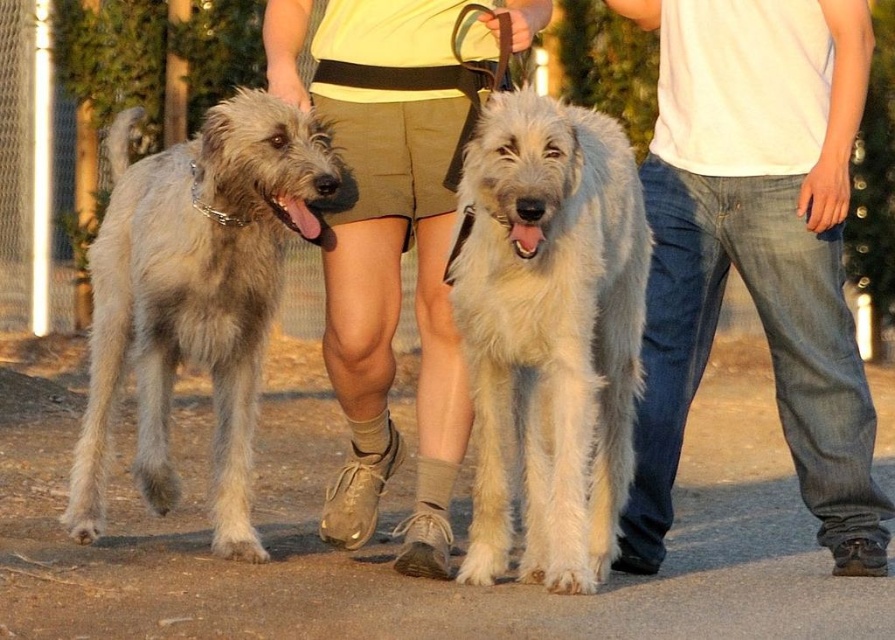
You are a photographer standing 10 feet away from the light gray fur at center. You want to take a closeup shot of it. Can you move closer to get a better shot without exceeding the maximum distance of 10 feet?

The light gray fur at center is 14.79 feet away from viewer. Since you are already 10 feet away, you cannot move closer as it would exceed the maximum distance limit of 10 feet.

You are a dog owner trying to choose between two outfits for your Irish Wolfhound. You have a light gray fur at center and light beige shorts at center. Which outfit is smaller?

The light gray fur at center has a smaller size compared to light beige shorts at center, so the light gray fur at center is the smaller outfit.